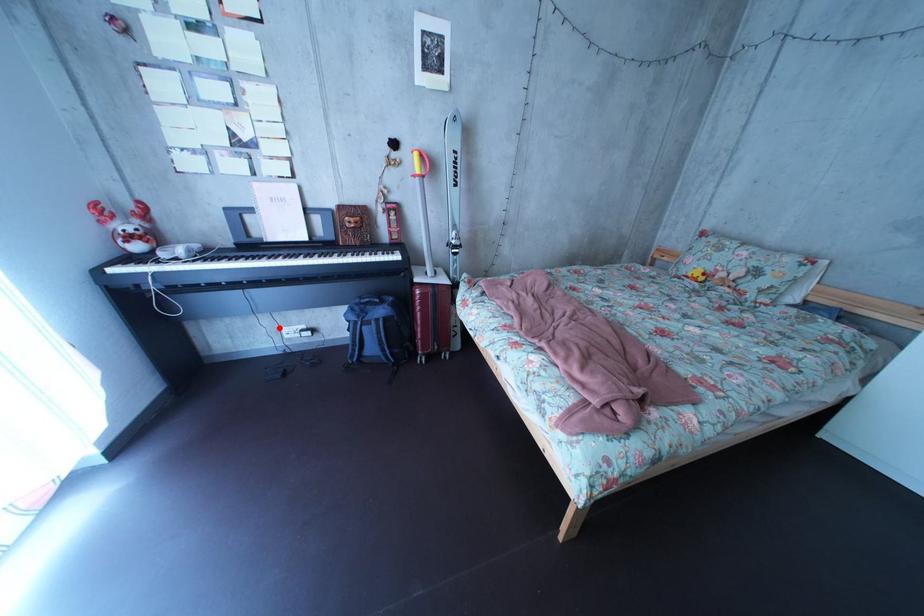
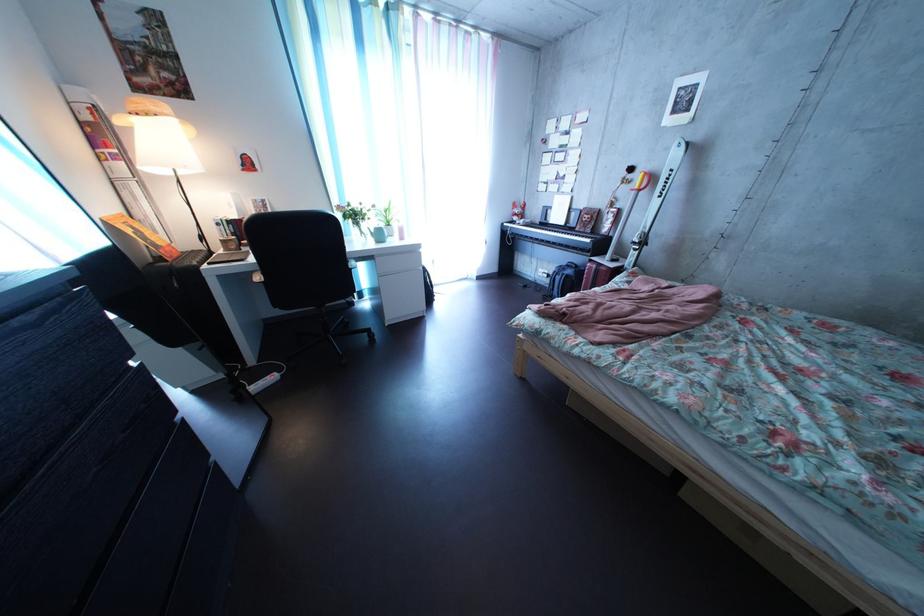
Where in the second image is the point corresponding to the highlighted location from the first image?

(550, 269)